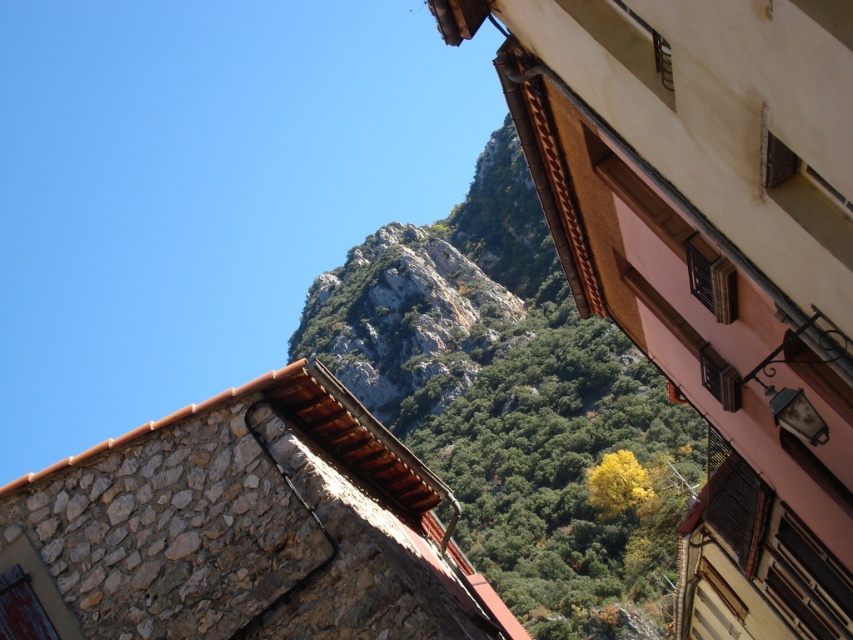
Question: Can you confirm if rockymaterial/texturemountain at center is positioned below rustic stone wall at center?

Choices:
 (A) no
 (B) yes

Answer: (A)

Question: Which object is closer to the camera taking this photo?

Choices:
 (A) rockymaterial/texturemountain at center
 (B) rustic stone wall at center

Answer: (B)

Question: Can you confirm if rockymaterial/texturemountain at center is positioned to the right of rustic stone wall at center?

Choices:
 (A) yes
 (B) no

Answer: (A)

Question: Which of the following is the farthest from the observer?

Choices:
 (A) rockymaterial/texturemountain at center
 (B) rustic stone wall at center

Answer: (A)

Question: Is rockymaterial/texturemountain at center closer to camera compared to rustic stone wall at center?

Choices:
 (A) yes
 (B) no

Answer: (B)